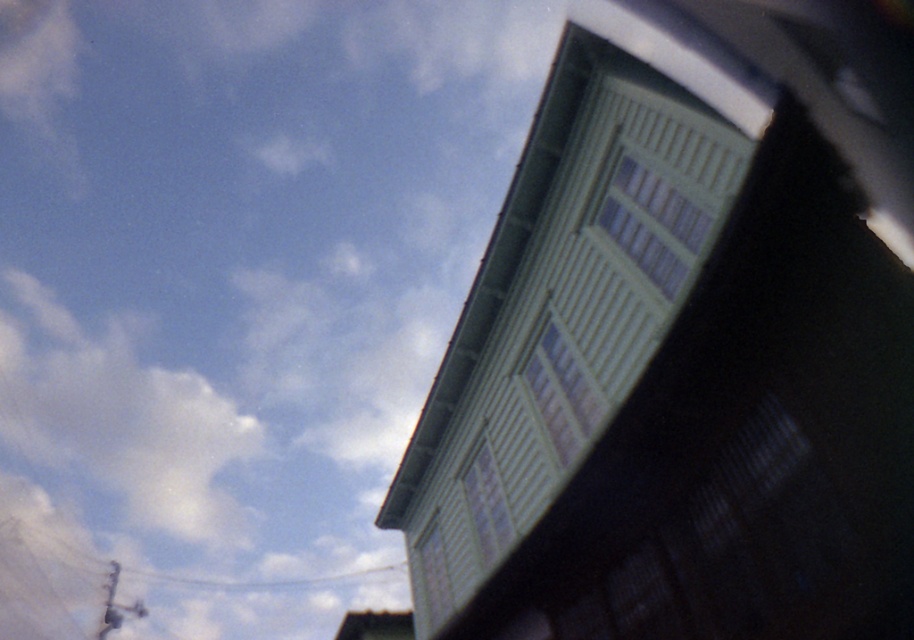
Consider the image. You are an architect reviewing the building design. You notice the green matte window at upper right and the metallic wire at upper center. Which object would appear larger in the blueprint if both are drawn to scale?

The green matte window at upper right would appear larger in the blueprint since it is closer to the viewer than the metallic wire at upper center, and objects closer to the viewer typically appear larger when scaled.

You are an architect designing a new building and want to ensure that the white fluffy cloud at upper left and the metallic wire at upper center are both visible in the design. Given their sizes, which one would you need to scale down to maintain a balanced composition?

The white fluffy cloud at upper left has a larger size compared to metallic wire at upper center. To maintain a balanced composition, you would need to scale down the white fluffy cloud at upper left since it is currently larger than the metallic wire at upper center.